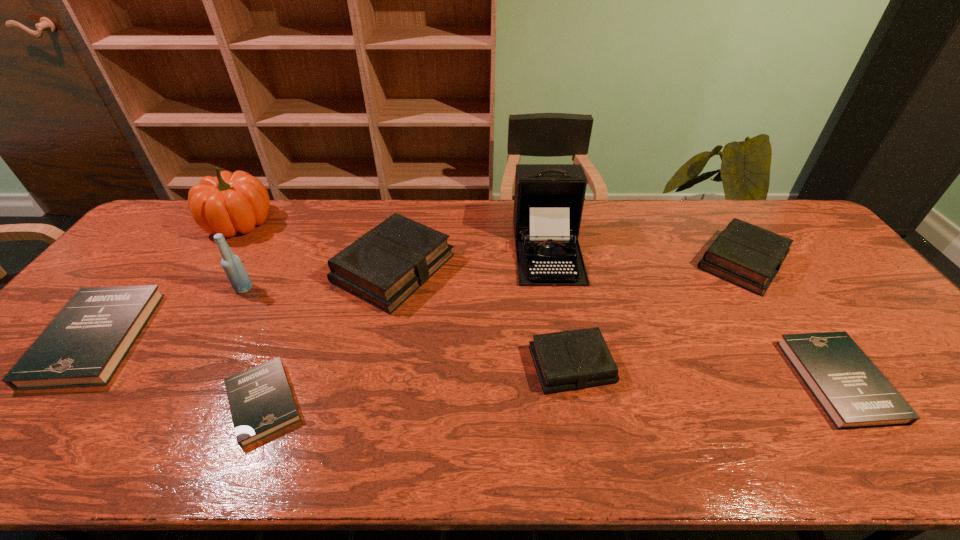
Locate an element on the screen. The image size is (960, 540). the leftmost book is located at coordinates (83, 346).

Identify the location of the second biggest dark book. pos(853,392).

Find the location of `the second shortest book`. the second shortest book is located at coordinates (853, 392).

At what (x,y) coordinates should I click in order to perform the action: click on the shortest object. Please return your answer as a coordinate pair (x, y). Looking at the image, I should click on (261, 402).

Identify the location of the second dark book from right to left. (261, 402).

Where is `vacant space located inside the open case of the typewriter`? vacant space located inside the open case of the typewriter is located at coordinates (566, 357).

At what (x,y) coordinates should I click in order to perform the action: click on free space located on the left of the pumpkin. Please return your answer as a coordinate pair (x, y). This screenshot has width=960, height=540. Looking at the image, I should click on (175, 223).

Locate an element on the screen. free spot located 0.060m on the front of the bottle is located at coordinates (231, 310).

At what (x,y) coordinates should I click in order to perform the action: click on vacant region located 0.230m on the front of the biggest greenish book. Please return your answer as a coordinate pair (x, y). Looking at the image, I should click on (368, 388).

Where is `vacant space located 0.060m on the right of the fifth shortest book`? The height and width of the screenshot is (540, 960). vacant space located 0.060m on the right of the fifth shortest book is located at coordinates (810, 261).